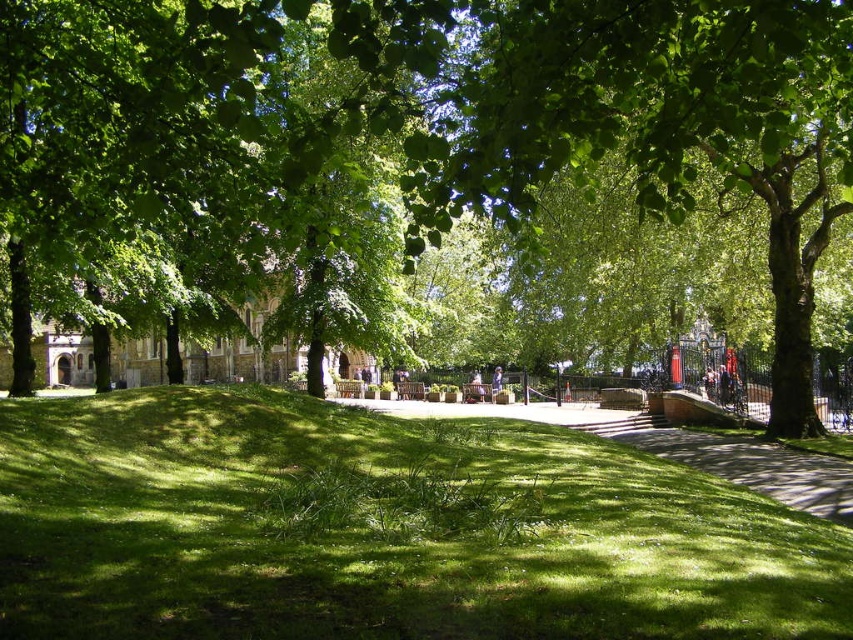
You are standing at the point marked as point [428,161] in the park. What is the nearest object to you?

The nearest object to you is the green leafy tree at center since the point [428,161] is located on it.

You are standing at the entrance of the park and see the green grassy hill at center and the green grass at center. Which one is located to the left side?

The green grassy hill at center is to the left of green grass at center.

You are standing at the point closer to the viewer between the two points, point (480, 38) and point (543, 611). If you want to walk towards the farther point, which direction should you move relative to the curved pathway?

To move towards the farther point (543, 611), you should walk along the curved pathway in the direction it bends to the right, since point (543, 611) is located further away from your current position at point (480, 38).